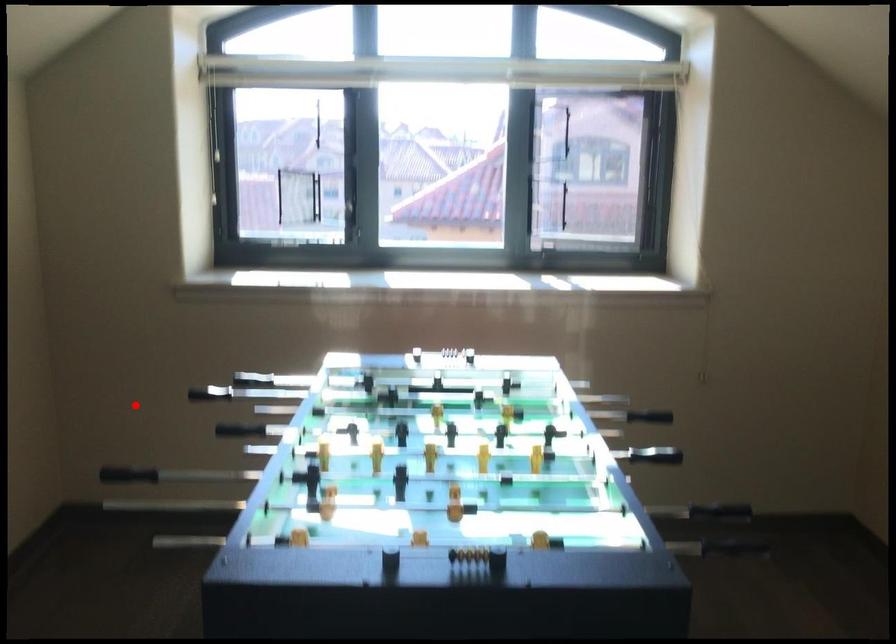
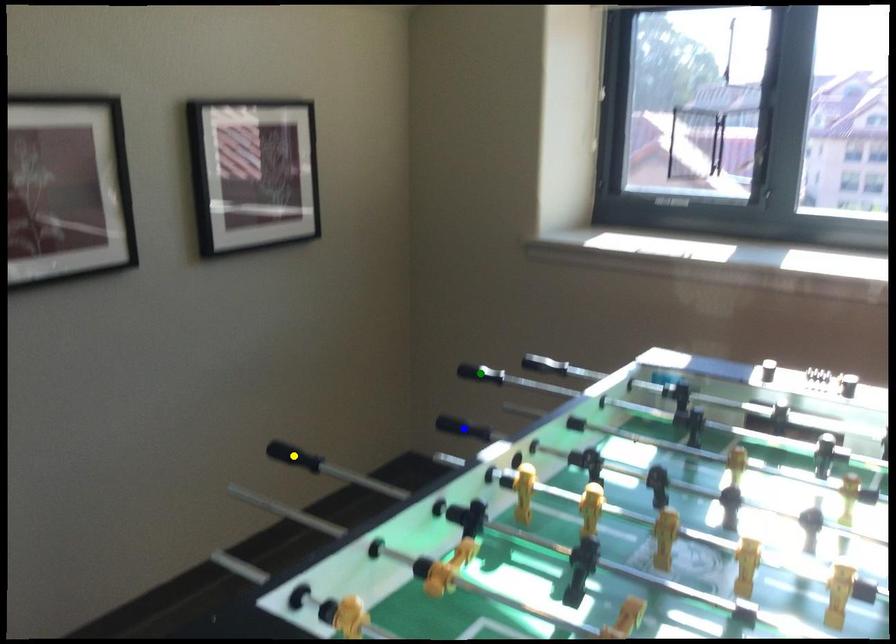
Question: I am providing you with two images of the same scene from different viewpoints. A red point is marked on the first image. You are given multiple points on the second image. Which point in image 2 is actually the same real-world point as the red point in image 1?

Choices:
 (A) blue point
 (B) green point
 (C) yellow point

Answer: (B)